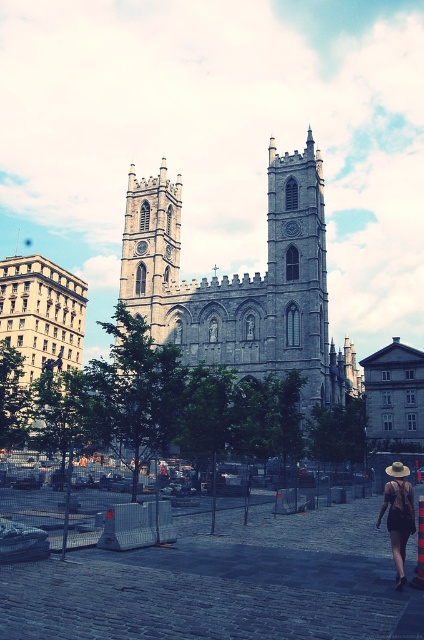
Question: Among these objects, which one is nearest to the camera?

Choices:
 (A) matte black dress at lower right
 (B) gray stone church at left
 (C) gray stone church at center

Answer: (A)

Question: Is gray stone church at center above gray stone church at left?

Choices:
 (A) yes
 (B) no

Answer: (A)

Question: Does gray stone church at center appear over matte black dress at lower right?

Choices:
 (A) no
 (B) yes

Answer: (B)

Question: Which object is farther from the camera taking this photo?

Choices:
 (A) gray stone church at center
 (B) matte black dress at lower right
 (C) gray stone church at left

Answer: (C)

Question: Does gray stone church at center have a lesser width compared to matte black dress at lower right?

Choices:
 (A) no
 (B) yes

Answer: (A)

Question: Which of the following is the farthest from the observer?

Choices:
 (A) (307, 216)
 (B) (21, 381)

Answer: (B)